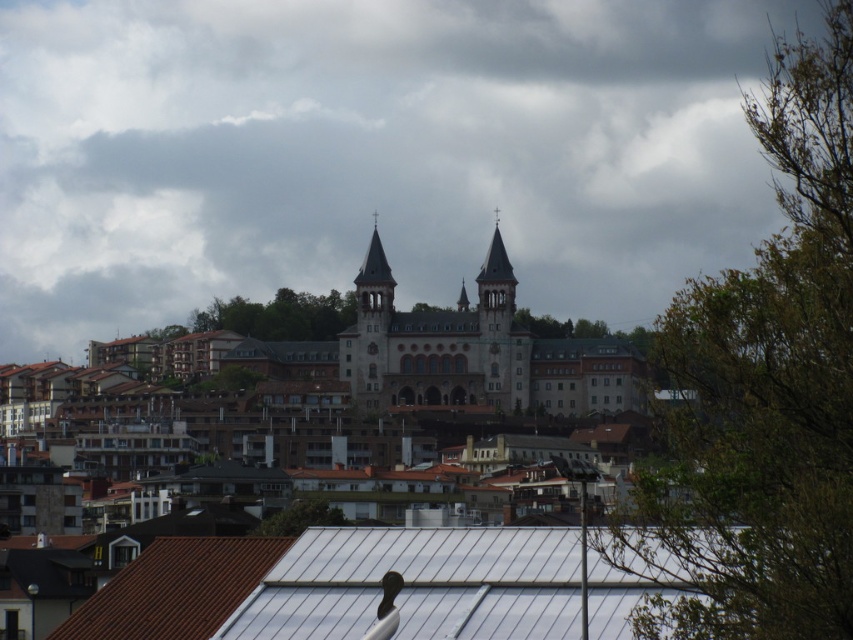
You are standing in the town square and want to take a photo that includes both the dark gray stone church at center and the smooth stone spire at center. Given that your camera can focus on objects within a 100 feet range, will both structures be in focus?

The dark gray stone church at center is 89.32 feet away from the smooth stone spire at center. Since both are within the 100 feet range of your camera, they will both be in focus.

Consider the image. You are an architect analyzing the town layout. You need to determine if the dark gray stone church at center can fit within the width of the smooth stone spire at center. Based on the scene, what is your conclusion?

The dark gray stone church at center is wider than the smooth stone spire at center, so it cannot fit within the spire.

You are standing in the town square and see two points marked on the ground. The first point is at coordinates point [386,262] and the second is at point [461,310]. Which point is closer to you?

Point [386,262] is in front of point [461,310], so it is closer to you.